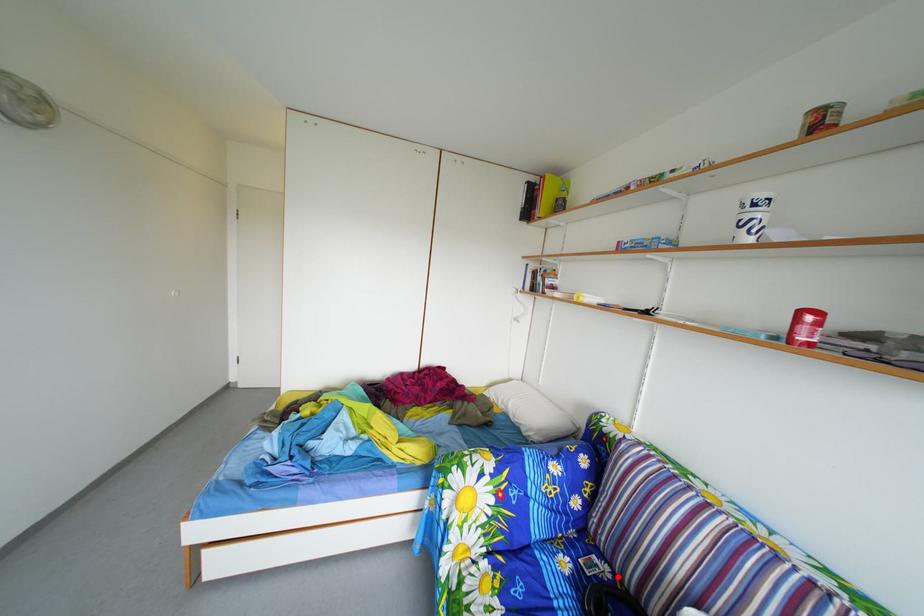
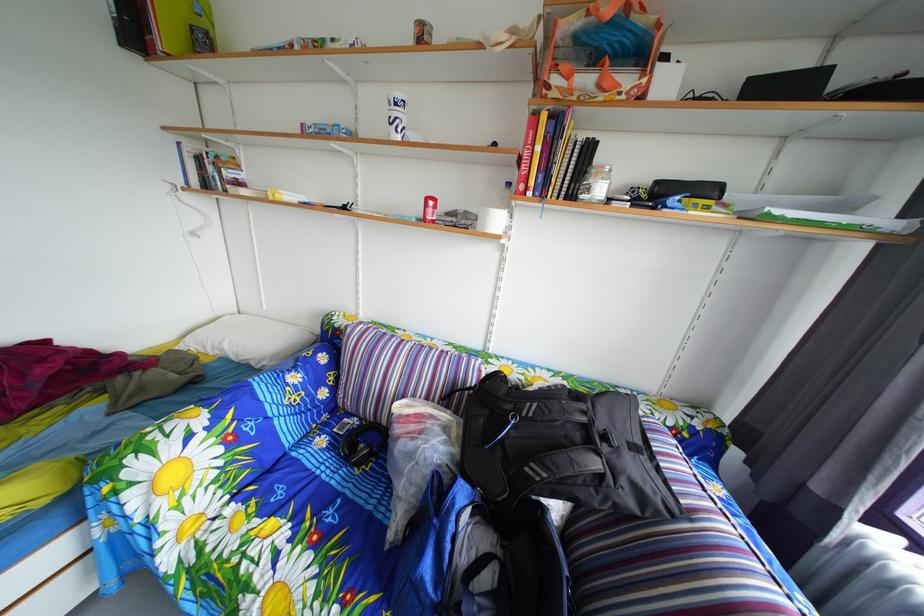
Question: I am providing you with two images of the same scene from different viewpoints. Image1 has a red point marked. In image2, the corresponding 3D location appears at what relative position? Reply with the corresponding letter.

Choices:
 (A) Closer
 (B) Farther

Answer: (B)